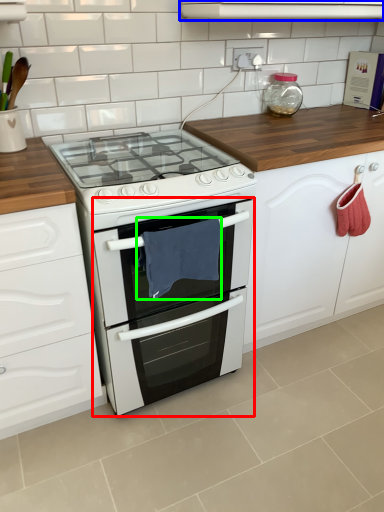
Question: Which object is positioned closest to oven (highlighted by a red box)? Select from vent (highlighted by a blue box) and material (highlighted by a green box).

Choices:
 (A) vent
 (B) material

Answer: (B)